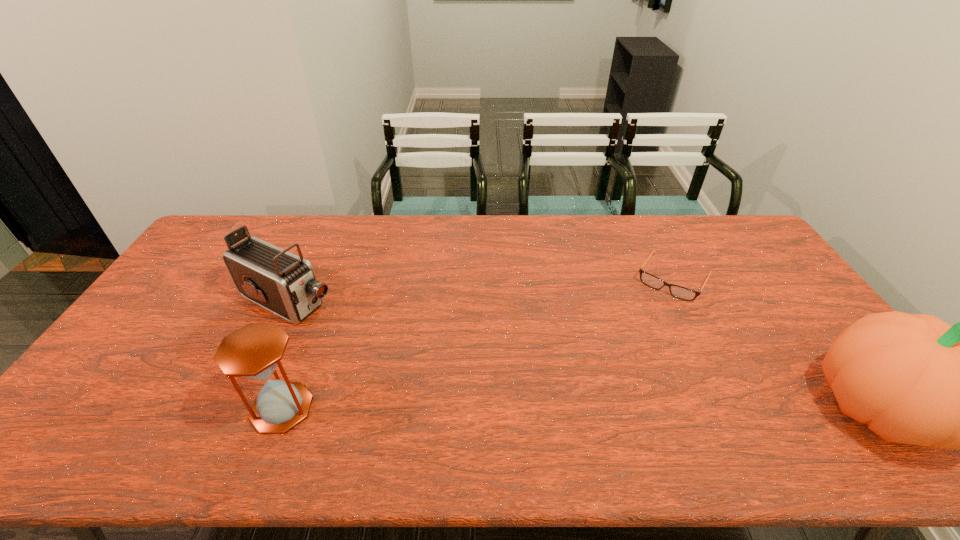
The height and width of the screenshot is (540, 960). I want to click on vacant space in between the hourglass and the camcorder, so click(x=285, y=354).

You are a GUI agent. You are given a task and a screenshot of the screen. Output one action in this format:
    pyautogui.click(x=<x>, y=<y>)
    Task: Click on the empty location between the camcorder and the hourglass
    
    Given the screenshot: What is the action you would take?
    pyautogui.click(x=285, y=354)

This screenshot has height=540, width=960. In order to click on empty space that is in between the hourglass and the camcorder in this screenshot , I will do `click(285, 354)`.

Where is `free spot between the camcorder and the shortest object`? Image resolution: width=960 pixels, height=540 pixels. free spot between the camcorder and the shortest object is located at coordinates (x=481, y=289).

At what (x,y) coordinates should I click in order to perform the action: click on empty space that is in between the spectacles and the camcorder. Please return your answer as a coordinate pair (x, y). Image resolution: width=960 pixels, height=540 pixels. Looking at the image, I should click on (481, 289).

Locate an element on the screen. The width and height of the screenshot is (960, 540). empty location between the shortest object and the hourglass is located at coordinates (478, 343).

The image size is (960, 540). Identify the location of object that is the closest to the shortest object. click(914, 379).

Choose which object is the nearest neighbor to the second object from right to left. Please provide its 2D coordinates. Your answer should be formatted as a tuple, i.e. [(x, y)], where the tuple contains the x and y coordinates of a point satisfying the conditions above.

[(914, 379)]